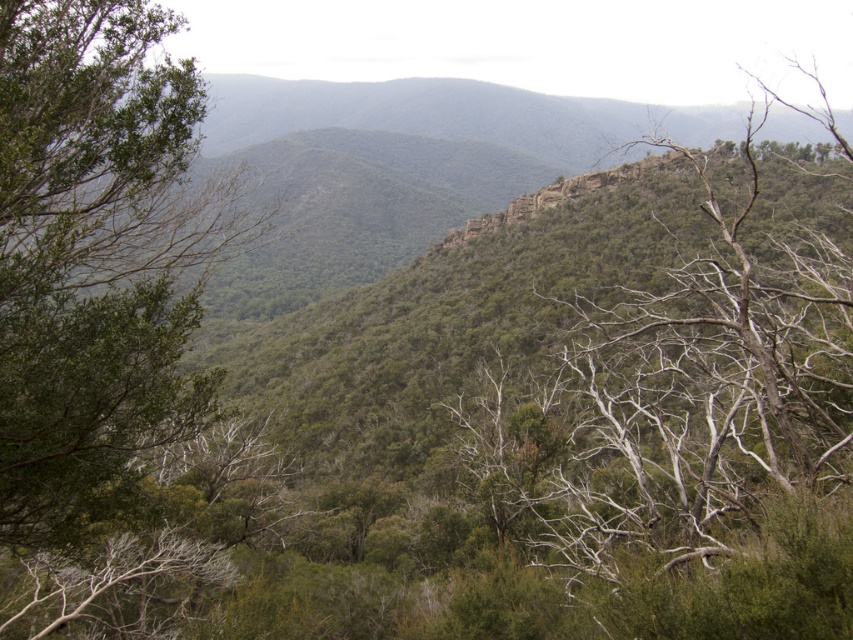
Can you confirm if green leafy tree at left is positioned above green leafy tree at upper right?

No, green leafy tree at left is not above green leafy tree at upper right.

Does green leafy tree at left have a greater height compared to green leafy tree at upper right?

No.

Is point (171, 177) behind point (811, 228)?

No, it is not.

Identify the location of green leafy tree at left. The height and width of the screenshot is (640, 853). 97,288.